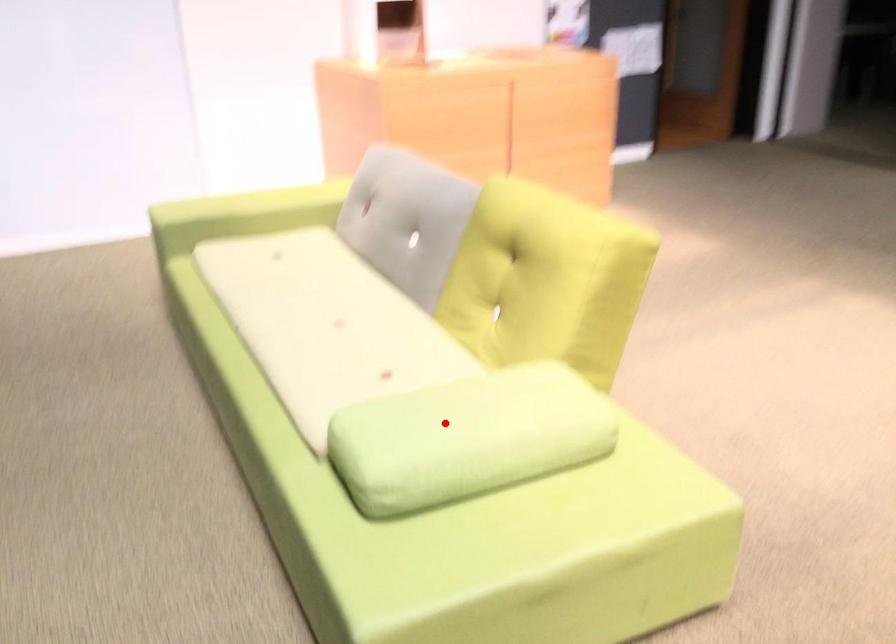
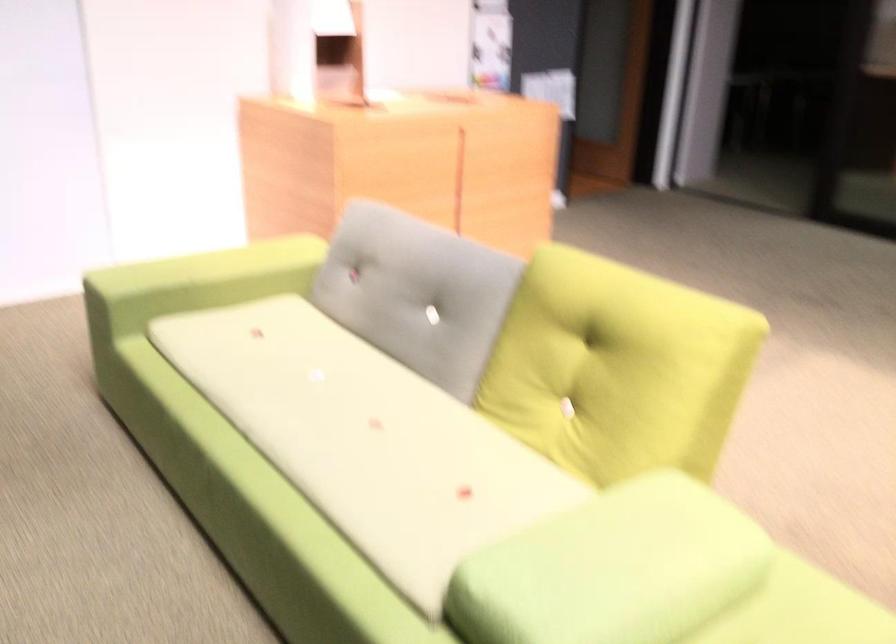
The point at the highlighted location is marked in the first image. Where is the corresponding point in the second image?

(613, 569)